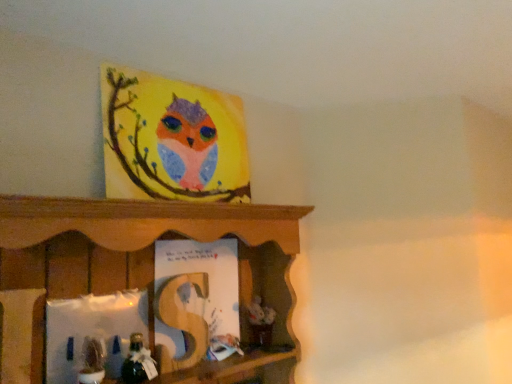
Question: From a real-world perspective, is shiny metallic toy at lower left, which appears as the first toy when viewed from the right, located higher than matte paper book at center?

Choices:
 (A) no
 (B) yes

Answer: (A)

Question: From the image's perspective, is shiny metallic toy at lower left, which appears as the first toy when viewed from the right, on matte paper book at center?

Choices:
 (A) yes
 (B) no

Answer: (B)

Question: Is shiny metallic toy at lower left, which ranks as the second toy in left-to-right order, located outside matte paper book at center?

Choices:
 (A) no
 (B) yes

Answer: (B)

Question: Is matte paper book at center at the back of shiny metallic toy at lower left, which ranks as the second toy in left-to-right order?

Choices:
 (A) no
 (B) yes

Answer: (A)

Question: From a real-world perspective, does shiny metallic toy at lower left, which appears as the first toy when viewed from the right, sit lower than matte paper book at center?

Choices:
 (A) yes
 (B) no

Answer: (A)

Question: From their relative heights in the image, would you say matte green plant at lower left, arranged as the 1th toy when viewed from the left, is taller or shorter than matte paper book at center?

Choices:
 (A) short
 (B) tall

Answer: (A)

Question: Is matte green plant at lower left, acting as the second toy starting from the right, situated inside matte paper book at center or outside?

Choices:
 (A) inside
 (B) outside

Answer: (B)

Question: Is matte green plant at lower left, acting as the second toy starting from the right, wider or thinner than matte paper book at center?

Choices:
 (A) thin
 (B) wide

Answer: (B)

Question: From the image's perspective, is matte green plant at lower left, arranged as the 1th toy when viewed from the left, above or below matte paper book at center?

Choices:
 (A) above
 (B) below

Answer: (B)

Question: From a real-world perspective, relative to matte green plant at lower left, acting as the second toy starting from the right, is matte paper book at center vertically above or below?

Choices:
 (A) above
 (B) below

Answer: (A)

Question: Would you say matte paper book at center is to the left or to the right of matte green plant at lower left, arranged as the 1th toy when viewed from the left, in the picture?

Choices:
 (A) left
 (B) right

Answer: (B)

Question: In terms of width, does matte paper book at center look wider or thinner when compared to matte green plant at lower left, acting as the second toy starting from the right?

Choices:
 (A) thin
 (B) wide

Answer: (A)

Question: Is matte paper book at center inside or outside of matte green plant at lower left, arranged as the 1th toy when viewed from the left?

Choices:
 (A) outside
 (B) inside

Answer: (A)

Question: Considering their positions, is matte green plant at lower left, acting as the second toy starting from the right, located in front of or behind shiny metallic toy at lower left, which ranks as the second toy in left-to-right order?

Choices:
 (A) front
 (B) behind

Answer: (A)

Question: Does point (91, 355) appear closer or farther from the camera than point (131, 362)?

Choices:
 (A) farther
 (B) closer

Answer: (B)